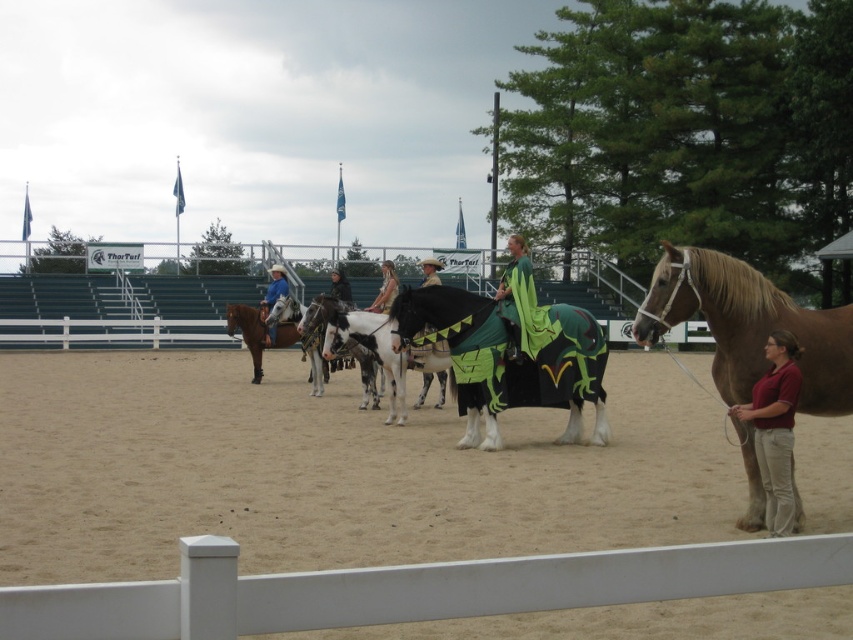
Based on the photo, does golden brown horse at right have a lesser height compared to white glossy horse at center?

In fact, golden brown horse at right may be taller than white glossy horse at center.

Who is positioned more to the right, golden brown horse at right or white glossy horse at center?

Positioned to the right is golden brown horse at right.

I want to click on golden brown horse at right, so click(747, 326).

Where is `golden brown horse at right`? The height and width of the screenshot is (640, 853). golden brown horse at right is located at coordinates (747, 326).

Is point (108, 472) positioned before point (274, 330)?

That is True.

Where is `sandy dirt field at center`? sandy dirt field at center is located at coordinates (329, 470).

Is point (375, 397) positioned before point (274, 289)?

That is True.

Is white speckled horse at center behind blue denim shirt at center?

No.

Is point (364, 401) positioned behind point (270, 344)?

No, (364, 401) is in front of (270, 344).

This screenshot has height=640, width=853. Identify the location of white speckled horse at center. (317, 333).